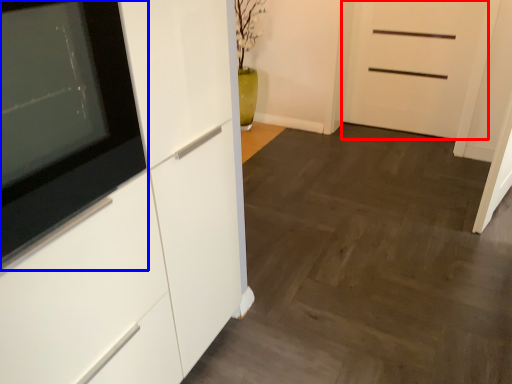
Question: Which of the following is the closest to the observer, door (highlighted by a red box) or appliance (highlighted by a blue box)?

Choices:
 (A) door
 (B) appliance

Answer: (B)